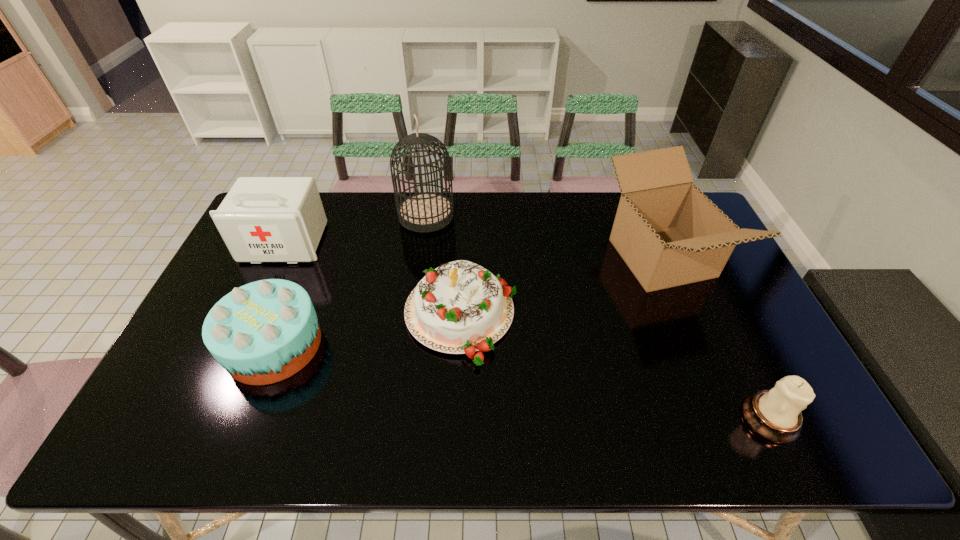
You are a GUI agent. You are given a task and a screenshot of the screen. Output one action in this format:
    pyautogui.click(x=<x>, y=<y>)
    Task: Click on the vacant space located on the right of the left cake
    This screenshot has width=960, height=540.
    Given the screenshot: What is the action you would take?
    coord(367,345)

Locate an element on the screen. This screenshot has height=540, width=960. vacant area situated 0.330m on the left of the candle holder is located at coordinates (603, 418).

Find the location of a particular element. Image resolution: width=960 pixels, height=540 pixels. birdcage that is at the far edge is located at coordinates (427, 211).

Where is `box situated at the far edge`? box situated at the far edge is located at coordinates (669, 233).

Where is `the first-aid kit present at the far edge`? the first-aid kit present at the far edge is located at coordinates (262, 219).

Identify the location of object that is at the near edge. (775, 415).

What are the coordinates of `the first-aid kit that is at the left edge` in the screenshot? It's located at (262, 219).

This screenshot has height=540, width=960. Identify the location of cake present at the left edge. (263, 332).

This screenshot has height=540, width=960. I want to click on box positioned at the right edge, so click(x=669, y=233).

Image resolution: width=960 pixels, height=540 pixels. Find the location of `candle holder that is at the right edge`. candle holder that is at the right edge is located at coordinates (775, 415).